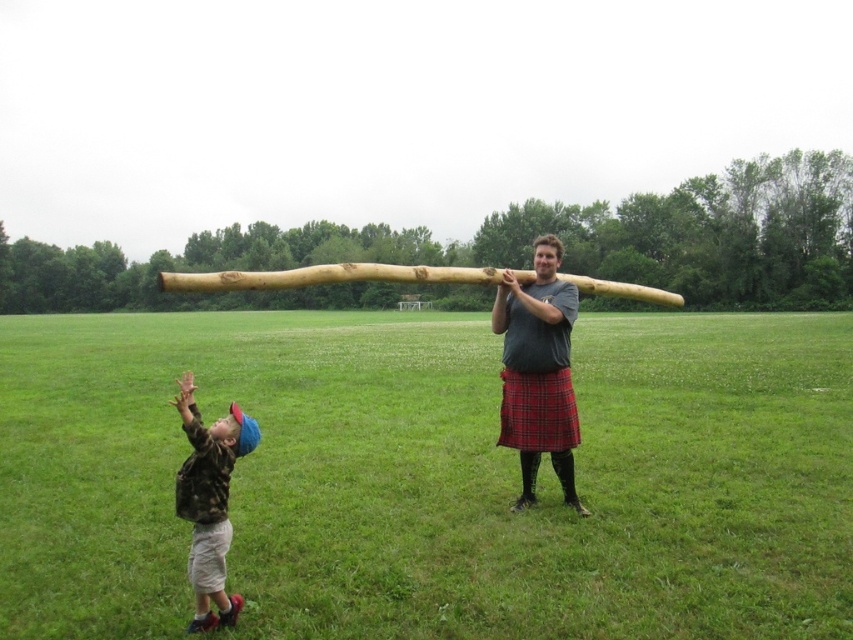
You are a gardener who wants to plant a new flower bed between the green grass at center and the wooden log at center. Based on their positions, which object should you start near to begin the flower bed?

The green grass at center is positioned on the left side of the wooden log at center, so you should start near the green grass at center to begin the flower bed since it is closer to the left side.

You are standing in the grassy field and want to walk from the green grass at center to the camouflage fabric shirt at lower left. Which direction should you face to walk directly towards it?

The green grass at center is positioned on the left side of the camouflage fabric shirt at lower left, so you should face to the left to walk directly towards the camouflage fabric shirt at lower left.